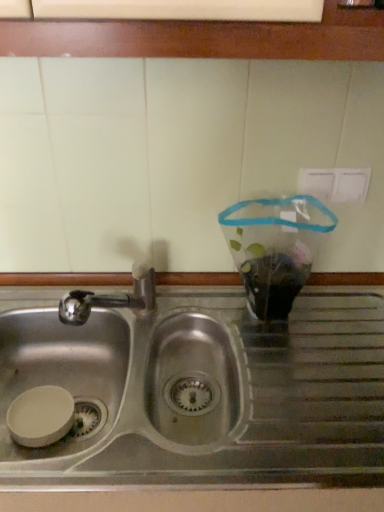
Question: From a real-world perspective, is metallic sink at lower center above or below stainless steel sink at center?

Choices:
 (A) below
 (B) above

Answer: (A)

Question: Considering the relative positions of metallic sink at lower center and stainless steel sink at center in the image provided, is metallic sink at lower center to the left or to the right of stainless steel sink at center?

Choices:
 (A) right
 (B) left

Answer: (B)

Question: Looking at the image, does metallic sink at lower center seem bigger or smaller compared to stainless steel sink at center?

Choices:
 (A) big
 (B) small

Answer: (B)

Question: From a real-world perspective, is stainless steel sink at center positioned above or below metallic sink at lower center?

Choices:
 (A) above
 (B) below

Answer: (A)

Question: From the image's perspective, is stainless steel sink at center located above or below metallic sink at lower center?

Choices:
 (A) below
 (B) above

Answer: (A)

Question: Is stainless steel sink at center inside or outside of metallic sink at lower center?

Choices:
 (A) inside
 (B) outside

Answer: (B)

Question: Would you say stainless steel sink at center is to the left or to the right of metallic sink at lower center in the picture?

Choices:
 (A) left
 (B) right

Answer: (B)